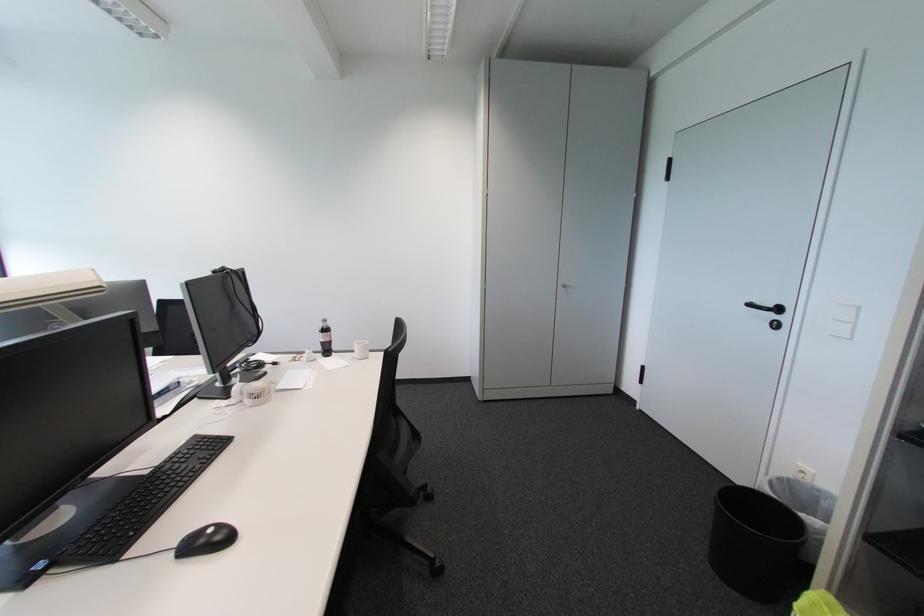
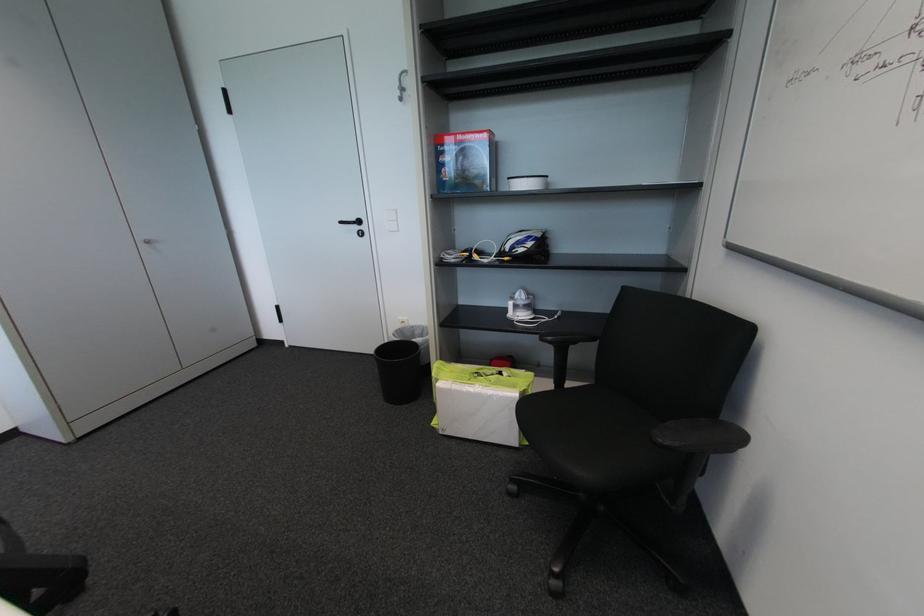
The point at (567, 290) is marked in the first image. Where is the corresponding point in the second image?

(151, 246)